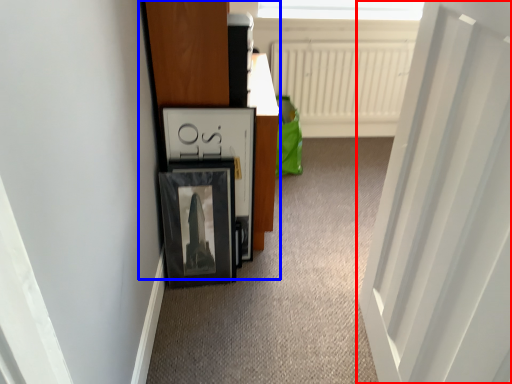
Question: Which point is closer to the camera, door (highlighted by a red box) or dresser (highlighted by a blue box)?

Choices:
 (A) door
 (B) dresser

Answer: (A)